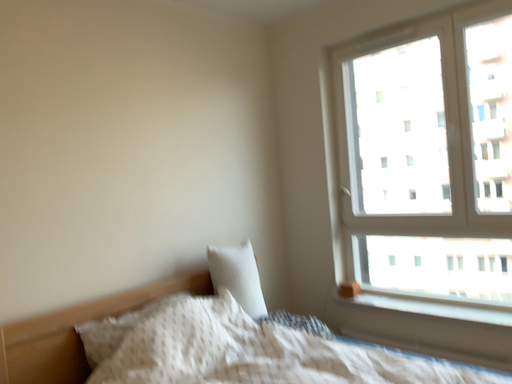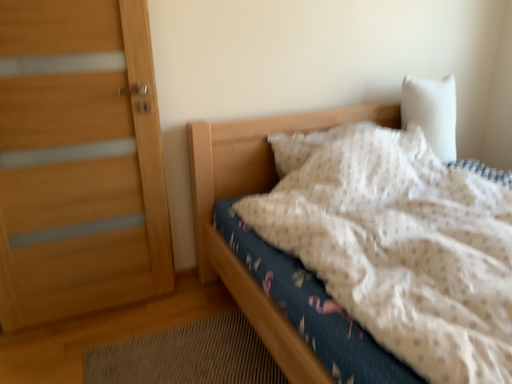
Question: How did the camera likely rotate when shooting the video?

Choices:
 (A) rotated upward
 (B) rotated downward

Answer: (B)